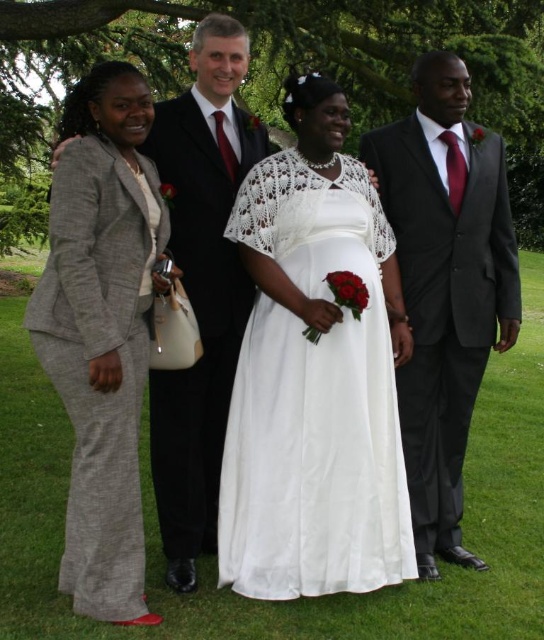
Question: Observing the image, what is the correct spatial positioning of gray wool suit at left in reference to matte black suit at right?

Choices:
 (A) below
 (B) above

Answer: (A)

Question: Which point appears farthest from the camera in this image?

Choices:
 (A) (514, 125)
 (B) (100, 179)
 (C) (191, 156)
 (D) (282, 202)

Answer: (A)

Question: Is green leafy tree at center above gray wool suit at left?

Choices:
 (A) no
 (B) yes

Answer: (B)

Question: Which point is closer to the camera?

Choices:
 (A) (264, 72)
 (B) (249, 502)
 (C) (172, 419)

Answer: (B)

Question: Is white satin dress at center bigger than matte black suit at right?

Choices:
 (A) yes
 (B) no

Answer: (A)

Question: Which is farther from the matte black suit at center?

Choices:
 (A) green leafy tree at center
 (B) matte black suit at right
 (C) gray wool suit at left
 (D) white satin dress at center

Answer: (A)